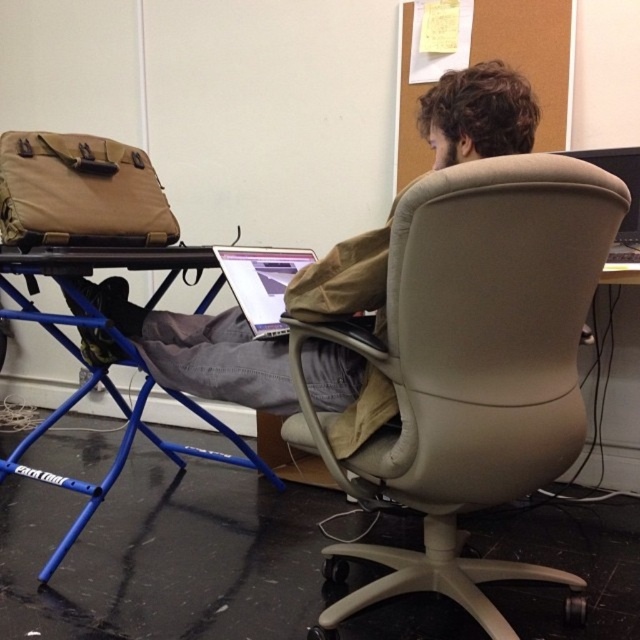
Question: Does beige fabric office chair at center have a smaller size compared to matte khaki jacket at center?

Choices:
 (A) yes
 (B) no

Answer: (B)

Question: Can you confirm if beige fabric office chair at center is positioned above matte khaki jacket at center?

Choices:
 (A) yes
 (B) no

Answer: (B)

Question: Can you confirm if beige fabric office chair at center is bigger than matte khaki jacket at center?

Choices:
 (A) no
 (B) yes

Answer: (B)

Question: Which point is farther to the camera?

Choices:
 (A) (364, 291)
 (B) (445, 403)

Answer: (A)